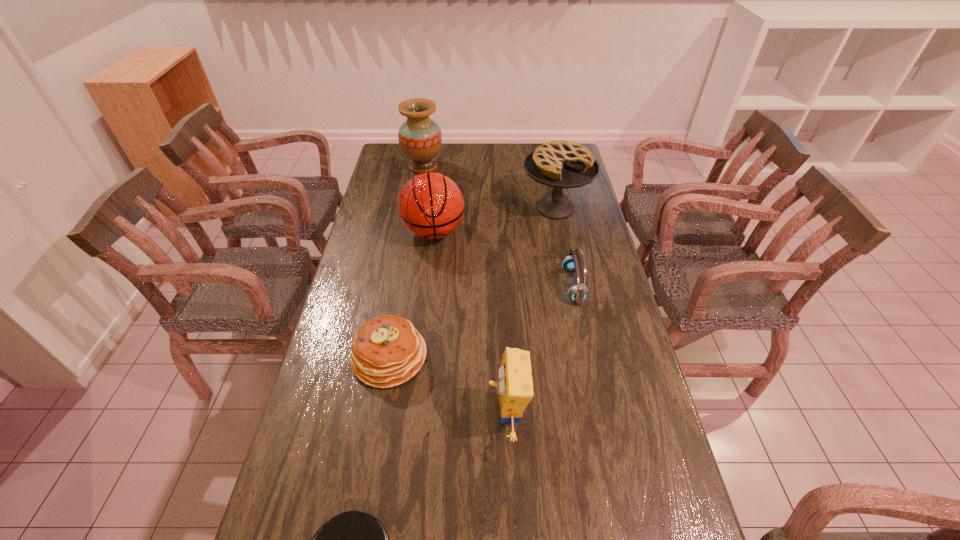
The width and height of the screenshot is (960, 540). Identify the location of free point located 0.290m on the cut side of the pie. (570, 284).

The image size is (960, 540). Identify the location of free space located on the side with spill of the basketball. (424, 312).

In order to click on vacant space positioned on the face of the fifth object from left to right in this screenshot , I will do `click(420, 414)`.

The width and height of the screenshot is (960, 540). I want to click on vacant area situated 0.270m on the face of the fifth object from left to right, so click(386, 414).

The image size is (960, 540). Identify the location of free space located on the face of the fifth object from left to right. (351, 414).

This screenshot has width=960, height=540. In order to click on free space located 0.050m on the ear cups of the fifth tallest object in this screenshot , I will do `click(549, 286)`.

I want to click on free point located on the ear cups of the fifth tallest object, so click(x=505, y=286).

Find the location of a particular element. blank area located on the ear cups of the fifth tallest object is located at coordinates (484, 286).

This screenshot has height=540, width=960. Identify the location of vacant region located 0.160m on the right of the second shortest object. (481, 356).

What are the coordinates of `object positioned at the far edge` in the screenshot? It's located at (420, 138).